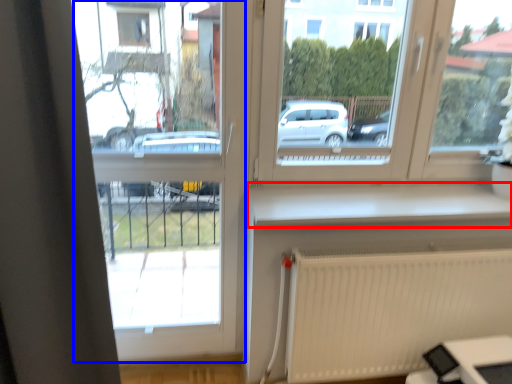
Question: Which object is further to the camera taking this photo, window sill (highlighted by a red box) or window frame (highlighted by a blue box)?

Choices:
 (A) window sill
 (B) window frame

Answer: (A)